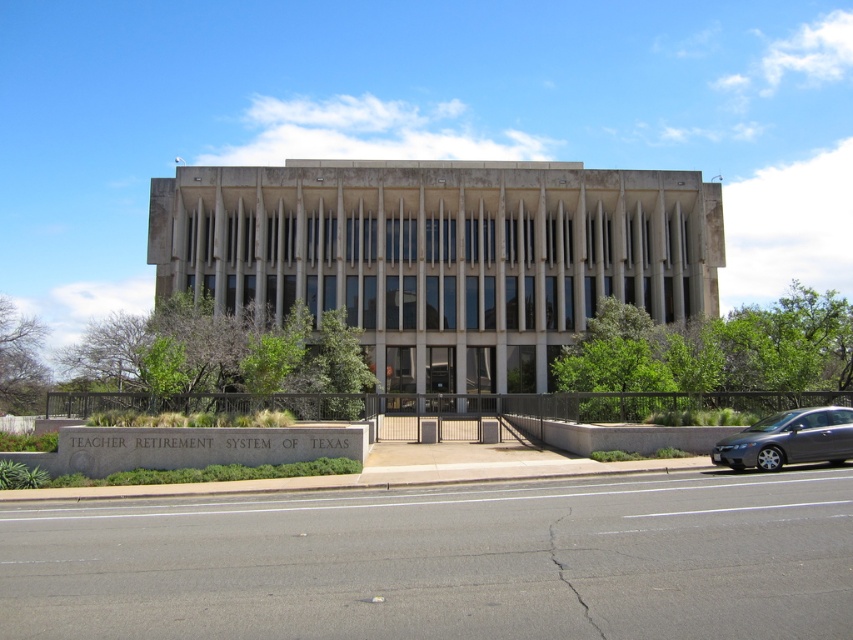
Question: Does asphalt at lower center have a greater width compared to silver metallic sedan at lower right?

Choices:
 (A) yes
 (B) no

Answer: (A)

Question: Is asphalt at lower center to the right of silver metallic sedan at lower right from the viewer's perspective?

Choices:
 (A) yes
 (B) no

Answer: (B)

Question: Among these objects, which one is nearest to the camera?

Choices:
 (A) asphalt at lower center
 (B) silver metallic sedan at lower right

Answer: (A)

Question: Where is asphalt at lower center located in relation to silver metallic sedan at lower right in the image?

Choices:
 (A) below
 (B) above

Answer: (A)